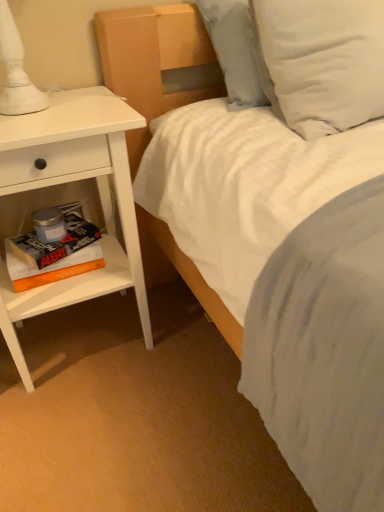
Locate an element on the screen. Image resolution: width=384 pixels, height=512 pixels. vacant space underneath white matte nightstand at left (from a real-world perspective) is located at coordinates (85, 336).